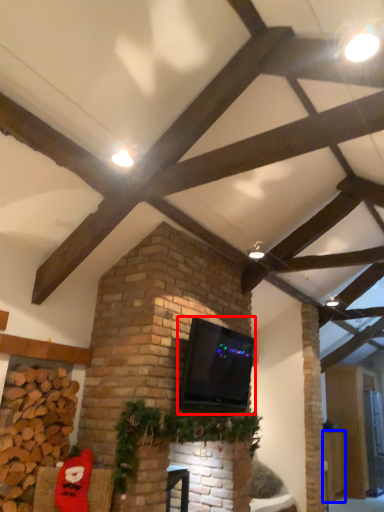
Question: Which object appears farthest to the camera in this image, wide (highlighted by a red box) or furniture (highlighted by a blue box)?

Choices:
 (A) wide
 (B) furniture

Answer: (B)